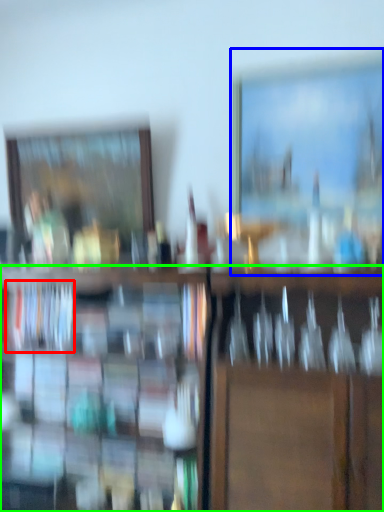
Question: Which is farther away from book (highlighted by a red box)? picture frame (highlighted by a blue box) or shelf (highlighted by a green box)?

Choices:
 (A) picture frame
 (B) shelf

Answer: (A)